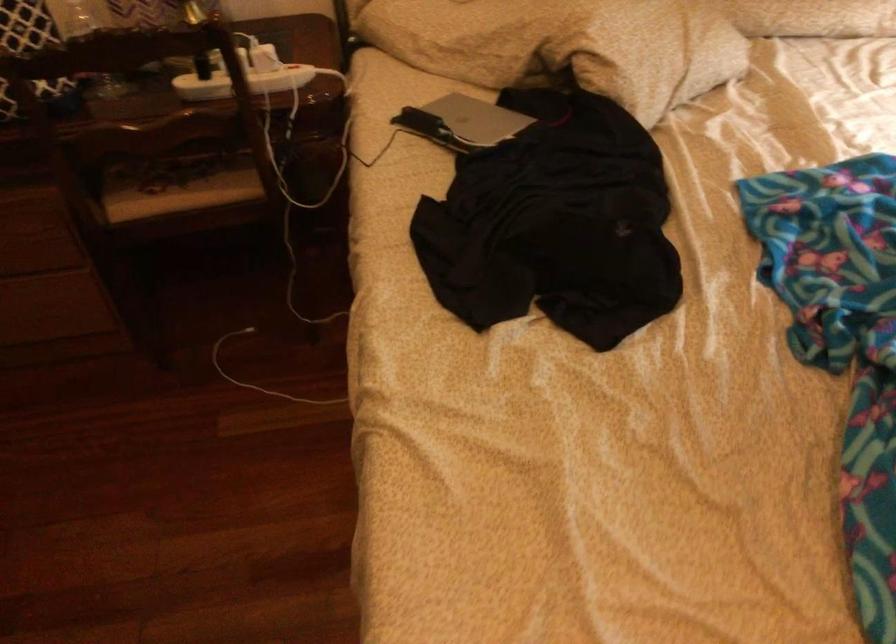
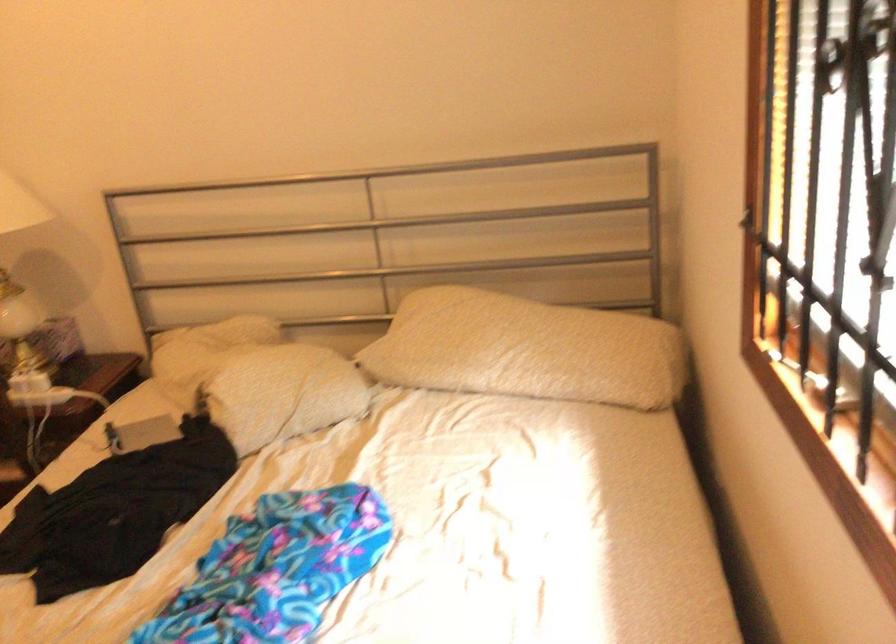
Question: The images are taken continuously from a first-person perspective. In which direction are you moving?

Choices:
 (A) Left
 (B) Right
 (C) Forward
 (D) Backward

Answer: (B)